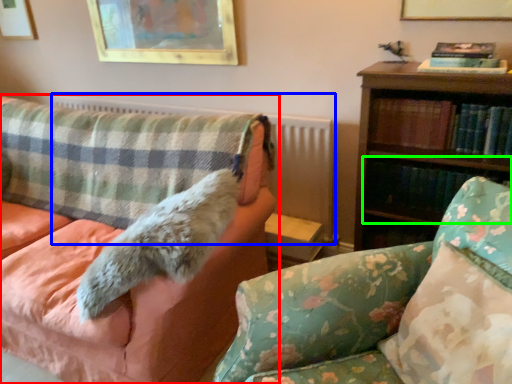
Question: Based on their relative distances, which object is nearer to studio couch (highlighted by a red box)? Choose from radiator (highlighted by a blue box) and book (highlighted by a green box).

Choices:
 (A) radiator
 (B) book

Answer: (A)